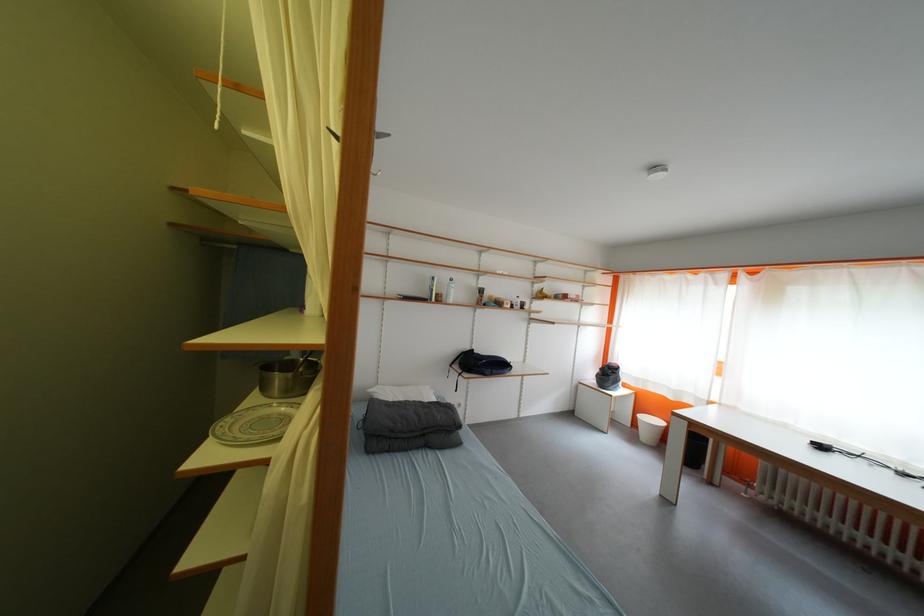
Where would you lift the metal cooking pot? Please return your answer as a coordinate pair (x, y).

(286, 377)